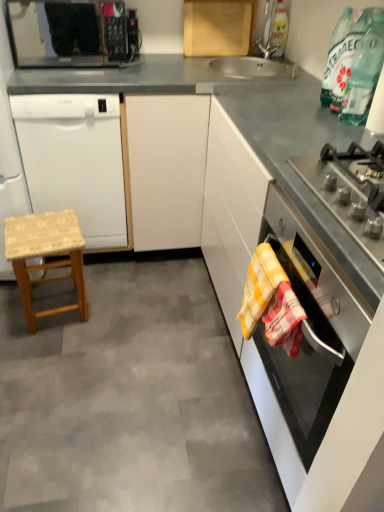
The width and height of the screenshot is (384, 512). What do you see at coordinates (218, 27) in the screenshot? I see `wooden cutting board at upper center` at bounding box center [218, 27].

What do you see at coordinates (72, 33) in the screenshot?
I see `black matte microwave at upper left` at bounding box center [72, 33].

What do you see at coordinates (130, 401) in the screenshot? I see `wooden stool at left` at bounding box center [130, 401].

The width and height of the screenshot is (384, 512). What are the coordinates of `yellow checkered towel at lower right, which is the second blanket in back-to-front order` in the screenshot? It's located at (284, 320).

Looking at this image, measure the distance between point (290,309) and camera.

Point (290,309) and camera are 3.43 feet apart from each other.

You are a GUI agent. You are given a task and a screenshot of the screen. Output one action in this format:
    pyautogui.click(x=<x>, y=<y>)
    Task: Click on the wooden cutting board at upper center
    This screenshot has height=512, width=384.
    Given the screenshot: What is the action you would take?
    pyautogui.click(x=218, y=27)

Is point (207, 41) less distant than point (97, 15)?

Yes, point (207, 41) is closer to viewer.

In the image, there is a wooden cutting board at upper center. Identify the location of kitchen appliance below it (from the image's perspective). (72, 33).

Considering the sizes of objects wooden cutting board at upper center and black matte microwave at upper left in the image provided, who is smaller, wooden cutting board at upper center or black matte microwave at upper left?

With smaller size is wooden cutting board at upper center.

Is wooden cutting board at upper center positioned far away from black matte microwave at upper left?

wooden cutting board at upper center is far away from black matte microwave at upper left.

Does point (101, 96) come behind point (135, 22)?

No, (101, 96) is in front of (135, 22).

Could you tell me if white matte dishwasher at left is facing black matte microwave at upper left?

No, white matte dishwasher at left is not aimed at black matte microwave at upper left.

Between white matte dishwasher at left and black matte microwave at upper left, which one has larger size?

Bigger between the two is white matte dishwasher at left.

Are white matte dishwasher at left and black matte microwave at upper left located far from each other?

Yes, white matte dishwasher at left and black matte microwave at upper left are quite far apart.

From a real-world perspective, is yellow checkered towel at lower right, which is the second blanket in back-to-front order, under wooden cutting board at upper center?

Yes, from a real-world perspective, yellow checkered towel at lower right, which is the second blanket in back-to-front order, is beneath wooden cutting board at upper center.

Is yellow checkered towel at lower right, arranged as the first blanket when viewed from the front, wider or thinner than wooden cutting board at upper center?

In the image, yellow checkered towel at lower right, arranged as the first blanket when viewed from the front, appears to be wider than wooden cutting board at upper center.

In the scene shown: Does yellow checkered towel at lower right, arranged as the first blanket when viewed from the front, have a greater height compared to wooden cutting board at upper center?

No.

Is yellow checkered towel at lower right, which is the second blanket in back-to-front order, positioned in front of wooden cutting board at upper center?

Yes.

In terms of width, does black matte microwave at upper left look wider or thinner when compared to yellow checkered towel at lower right, which is the first blanket in back-to-front order?

Considering their sizes, black matte microwave at upper left looks broader than yellow checkered towel at lower right, which is the first blanket in back-to-front order.

Is black matte microwave at upper left spatially inside yellow checkered towel at lower right, which is the first blanket in back-to-front order, or outside of it?

black matte microwave at upper left is outside yellow checkered towel at lower right, which is the first blanket in back-to-front order.

Based on their sizes in the image, would you say black matte microwave at upper left is bigger or smaller than yellow checkered towel at lower right, the second blanket when ordered from front to back?

black matte microwave at upper left is bigger than yellow checkered towel at lower right, the second blanket when ordered from front to back.

Is black matte microwave at upper left further to camera compared to yellow checkered towel at lower right, the second blanket when ordered from front to back?

Yes, it is behind yellow checkered towel at lower right, the second blanket when ordered from front to back.

Is satin silver gas stove at right located outside black matte microwave at upper left?

That's correct, satin silver gas stove at right is outside of black matte microwave at upper left.

Is the depth of satin silver gas stove at right greater than that of black matte microwave at upper left?

No, it is in front of black matte microwave at upper left.

What's the angular difference between satin silver gas stove at right and black matte microwave at upper left's facing directions?

90.1 degrees separate the facing orientations of satin silver gas stove at right and black matte microwave at upper left.

Is satin silver gas stove at right next to black matte microwave at upper left and touching it?

No, satin silver gas stove at right is not making contact with black matte microwave at upper left.

Can you confirm if black glass oven at right is bigger than wooden stool at left?

Indeed, black glass oven at right has a larger size compared to wooden stool at left.

Are black glass oven at right and wooden stool at left beside each other?

No, black glass oven at right is not with wooden stool at left.

In the scene shown: From a real-world perspective, between black glass oven at right and wooden stool at left, who is vertically lower?

wooden stool at left, from a real-world perspective.

Is yellow checkered towel at lower right, arranged as the first blanket when viewed from the front, beside wooden stool at left?

No, yellow checkered towel at lower right, arranged as the first blanket when viewed from the front, is not beside wooden stool at left.

How many degrees apart are the facing directions of yellow checkered towel at lower right, arranged as the first blanket when viewed from the front, and wooden stool at left?

The facing directions of yellow checkered towel at lower right, arranged as the first blanket when viewed from the front, and wooden stool at left are 0.201 degrees apart.

Between yellow checkered towel at lower right, which is the second blanket in back-to-front order, and wooden stool at left, which one appears on the left side from the viewer's perspective?

wooden stool at left.

Is yellow checkered towel at lower right, which is the second blanket in back-to-front order, spatially inside wooden stool at left, or outside of it?

yellow checkered towel at lower right, which is the second blanket in back-to-front order, is not inside wooden stool at left, it's outside.

Identify the location of cabinetry above the black matte microwave at upper left (from the image's perspective). The width and height of the screenshot is (384, 512). (218, 27).

Find the location of `dishwasher below the black matte microwave at upper left (from a real-world perspective)`. dishwasher below the black matte microwave at upper left (from a real-world perspective) is located at coordinates (78, 162).

From the image, which object appears to be farther from black matte microwave at upper left, yellow checkered towel at lower right, arranged as the first blanket when viewed from the front, or white matte dishwasher at left?

The object further to black matte microwave at upper left is yellow checkered towel at lower right, arranged as the first blanket when viewed from the front.

Considering their positions, is wooden cutting board at upper center positioned further to black glass oven at right than black matte microwave at upper left?

black matte microwave at upper left is positioned further to the anchor black glass oven at right.

From the image, which object appears to be nearer to wooden stool at left, woven wood stool at lower left or satin silver gas stove at right?

The object closer to wooden stool at left is woven wood stool at lower left.

Based on their spatial positions, is yellow checkered towel at lower right, arranged as the first blanket when viewed from the front, or black matte microwave at upper left further from woven wood stool at lower left?

black matte microwave at upper left is positioned further to the anchor woven wood stool at lower left.

From the image, which object appears to be farther from wooden cutting board at upper center, yellow checkered towel at lower right, which is the first blanket in back-to-front order, or woven wood stool at lower left?

yellow checkered towel at lower right, which is the first blanket in back-to-front order, is further to wooden cutting board at upper center.

From the image, which object appears to be farther from black glass oven at right, yellow checkered towel at lower right, the second blanket when ordered from front to back, or yellow checkered towel at lower right, which is the second blanket in back-to-front order?

yellow checkered towel at lower right, which is the second blanket in back-to-front order, is positioned further to the anchor black glass oven at right.

Considering their positions, is yellow checkered towel at lower right, which is the second blanket in back-to-front order, positioned further to wooden cutting board at upper center than wooden stool at left?

yellow checkered towel at lower right, which is the second blanket in back-to-front order.

Which object lies further to the anchor point transparent glass bottle at upper right, black glass oven at right or yellow checkered towel at lower right, which is the second blanket in back-to-front order?

yellow checkered towel at lower right, which is the second blanket in back-to-front order, lies further to transparent glass bottle at upper right than the other object.

The height and width of the screenshot is (512, 384). Identify the location of dishwasher between black matte microwave at upper left and yellow checkered towel at lower right, which is the first blanket in back-to-front order, in the vertical direction. (78, 162).

Where is `dishwasher between woven wood stool at lower left and black glass oven at right in the horizontal direction`? Image resolution: width=384 pixels, height=512 pixels. dishwasher between woven wood stool at lower left and black glass oven at right in the horizontal direction is located at coordinates (78, 162).

Identify the location of bottle between wooden cutting board at upper center and woven wood stool at lower left in the vertical direction. click(x=364, y=73).

Where is `concrete located between white matte dishwasher at left and transparent glass bottle at upper right in the left-right direction`? concrete located between white matte dishwasher at left and transparent glass bottle at upper right in the left-right direction is located at coordinates (130, 401).